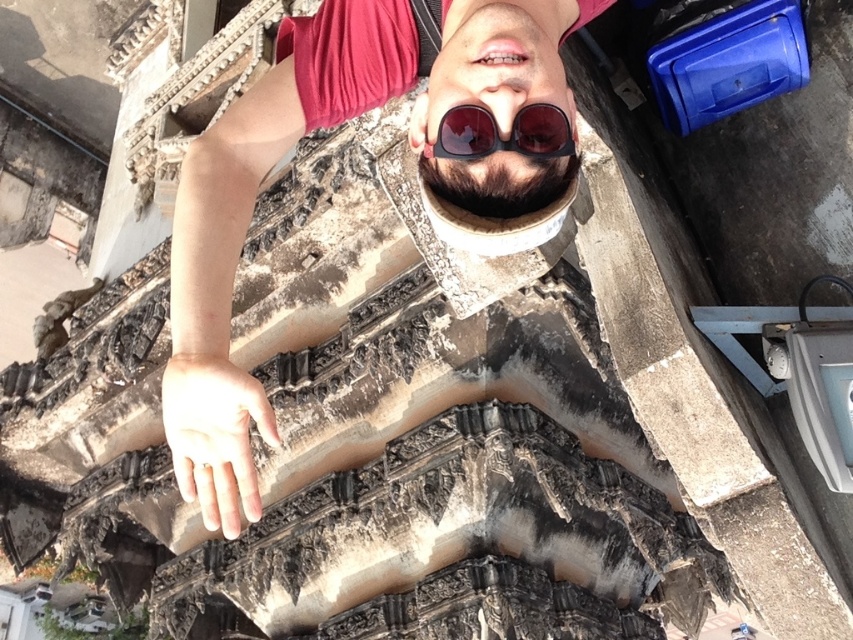
From the picture: You are a photographer trying to capture the best angle of the person in the image. The person is wearing two pairs of sunglasses at the center. Which sunglasses are positioned higher on the face, the matte black sunglasses at center or the shiny dark sunglasses at center?

The matte black sunglasses at center is much taller as shiny dark sunglasses at center, so the matte black sunglasses at center are positioned higher on the face.